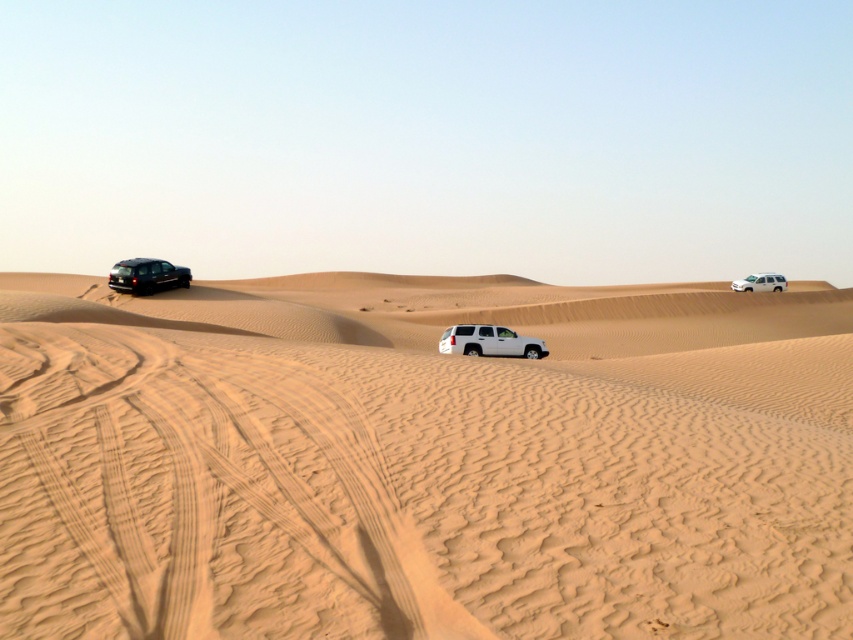
You are planning to transport a large cargo container that requires a vehicle with a minimum width of 2 meters. Given the scene, which of the two SUVs, the shiny black suv at left or the white matte suv at upper right, would be more suitable for your needs based on their widths?

The shiny black suv at left has a greater width than the white matte suv at upper right, so it would be more suitable for transporting the large cargo container requiring a minimum width of 2 meters.